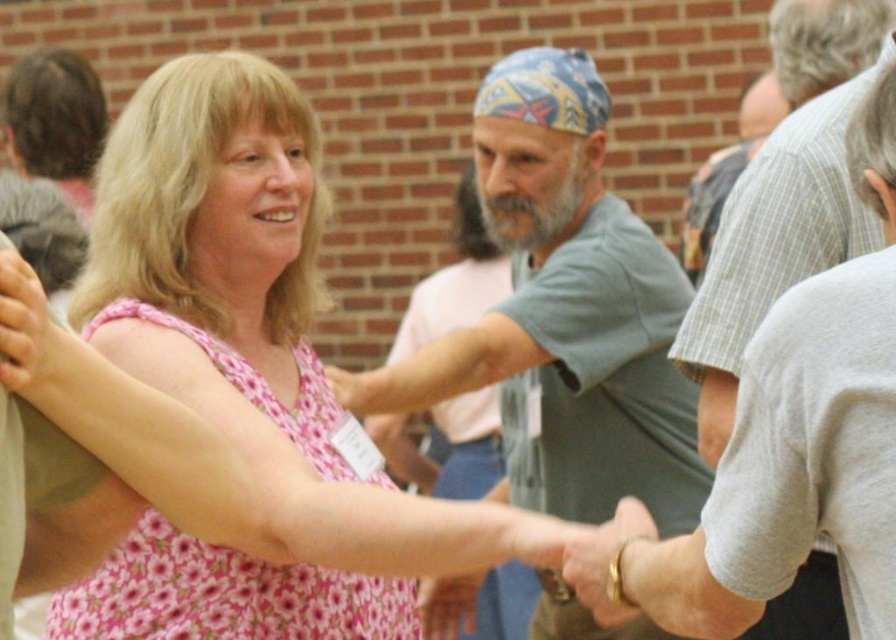
You are standing at the center of the gathering and want to take a photo of both the point at (674, 461) and the point at (831, 243). To ensure both are in focus, you need to know which point is closer to you. Which point is closer?

Point (831, 243) is closer to you than point (674, 461) because the description states that point (674, 461) is behind point (831, 243).

You are a photographer trying to capture a candid shot of the two people at the gathering. You notice both the gray cotton shirt at center and the gray plaid shirt at center. Which shirt should you focus on if you want to photograph the taller individual?

The gray cotton shirt at center is taller than the gray plaid shirt at center, so you should focus on the gray cotton shirt at center to photograph the taller individual.